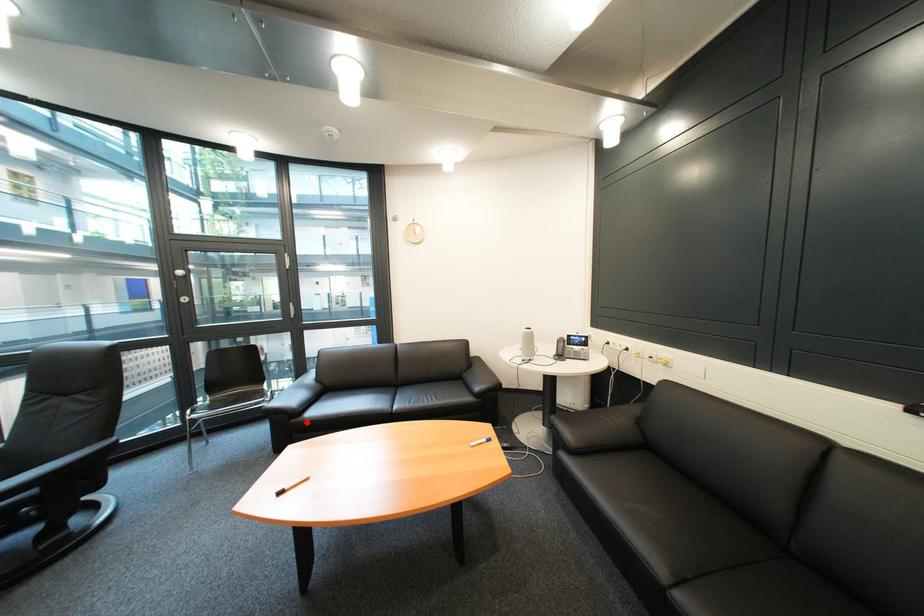
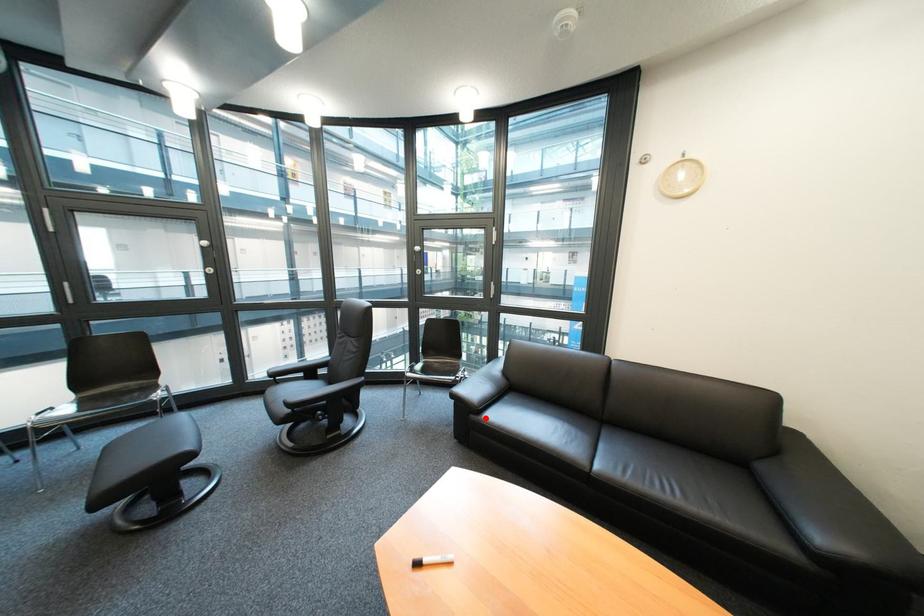
I am providing you with two images of the same scene from different viewpoints. A red point is marked on the first image and another point is marked on the second image. Does the point marked in image1 correspond to the same location as the one in image2?

Yes